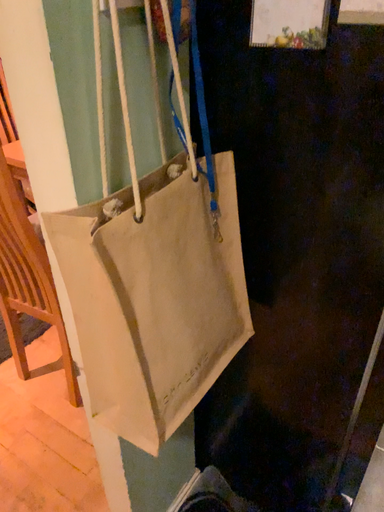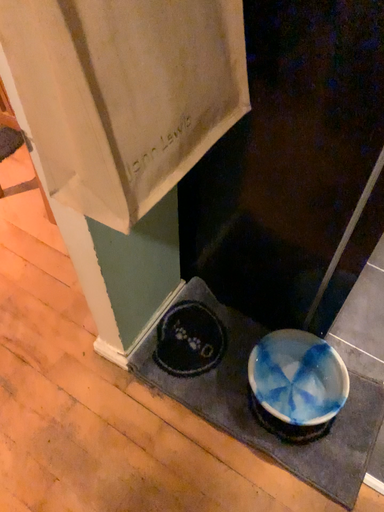
Question: Which way did the camera rotate in the video?

Choices:
 (A) rotated upward
 (B) rotated downward

Answer: (B)